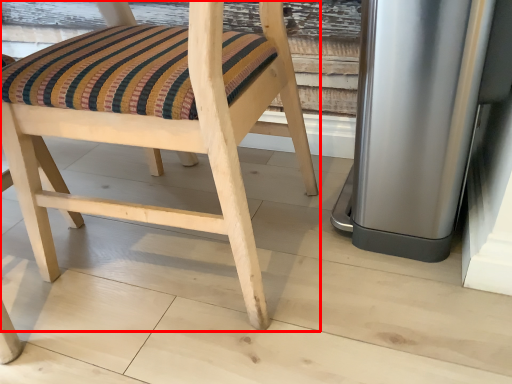
Question: From the image's perspective, what is the correct spatial positioning of chair (annotated by the red box) in reference to appliance?

Choices:
 (A) below
 (B) above

Answer: (A)